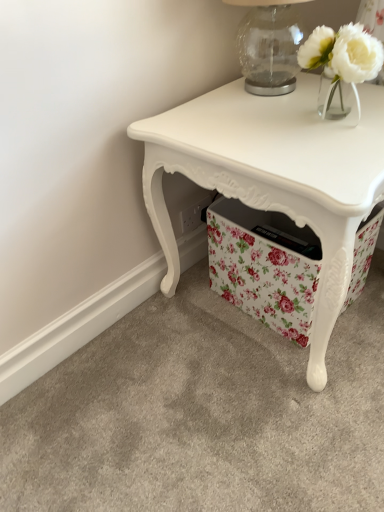
Describe the element at coordinates (269, 45) in the screenshot. I see `transparent glass table lamp at upper right` at that location.

Describe the element at coordinates (274, 176) in the screenshot. The height and width of the screenshot is (512, 384). I see `white glossy table at center` at that location.

The image size is (384, 512). What are the coordinates of `floral fabric storage box at lower center` in the screenshot? It's located at (264, 266).

Image resolution: width=384 pixels, height=512 pixels. What do you see at coordinates (264, 266) in the screenshot?
I see `floral fabric storage box at lower center` at bounding box center [264, 266].

Where is `white glass vase at upper right`? white glass vase at upper right is located at coordinates (341, 67).

Which is behind, point (275, 57) or point (316, 240)?

The point (316, 240) is behind.

Is transparent glass table lamp at upper right shorter than floral fabric storage box at lower center?

Indeed, transparent glass table lamp at upper right has a lesser height compared to floral fabric storage box at lower center.

Is transparent glass table lamp at upper right located outside floral fabric storage box at lower center?

Yes, transparent glass table lamp at upper right is not within floral fabric storage box at lower center.

From the picture: How different are the orientations of transparent glass table lamp at upper right and floral fabric storage box at lower center in degrees?

transparent glass table lamp at upper right and floral fabric storage box at lower center are facing 5.46 degrees away from each other.

From a real-world perspective, who is located higher, floral fabric storage box at lower center or white glossy table at center?

white glossy table at center, from a real-world perspective.

Which object is closer to the camera, floral fabric storage box at lower center or white glossy table at center?

white glossy table at center is closer to the camera.

Could white glossy table at center be considered to be inside floral fabric storage box at lower center?

Definitely not — white glossy table at center is not inside floral fabric storage box at lower center.

Can you confirm if floral fabric storage box at lower center is taller than white glossy table at center?

No.

Which is behind, point (307, 271) or point (319, 112)?

The point (307, 271) is farther from the camera.

Which object is wider, floral fabric storage box at lower center or white glass vase at upper right?

floral fabric storage box at lower center is wider.

Does floral fabric storage box at lower center lie in front of white glass vase at upper right?

That is False.

Is floral fabric storage box at lower center bigger or smaller than white glass vase at upper right?

In the image, floral fabric storage box at lower center appears to be larger than white glass vase at upper right.

Where is `table below the white glass vase at upper right (from a real-world perspective)`? The height and width of the screenshot is (512, 384). table below the white glass vase at upper right (from a real-world perspective) is located at coordinates (274, 176).

Is point (255, 124) positioned in front of point (324, 72)?

That is True.

From the picture: Is white glass vase at upper right located within white glossy table at center?

No, white glass vase at upper right is not a part of white glossy table at center.

Is floral fabric storage box at lower center inside white glossy table at center?

Yes, floral fabric storage box at lower center is a part of white glossy table at center.

Considering the sizes of objects white glossy table at center and floral fabric storage box at lower center in the image provided, who is smaller, white glossy table at center or floral fabric storage box at lower center?

floral fabric storage box at lower center is smaller.

Does point (377, 182) appear closer or farther from the camera than point (279, 332)?

Clearly, point (377, 182) is closer to the camera than point (279, 332).

Is floral fabric storage box at lower center turned away from transparent glass table lamp at upper right?

No, floral fabric storage box at lower center is not facing away from transparent glass table lamp at upper right.

Which point is more distant from viewer, (298, 317) or (251, 22)?

The point (251, 22) is farther.

Is floral fabric storage box at lower center further to the viewer compared to transparent glass table lamp at upper right?

Yes, it is behind transparent glass table lamp at upper right.

At what (x,y) coordinates should I click in order to perform the action: click on floral arrangement in front of the floral fabric storage box at lower center. Please return your answer as a coordinate pair (x, y). The height and width of the screenshot is (512, 384). Looking at the image, I should click on tap(341, 67).

Is floral fabric storage box at lower center a part of white glass vase at upper right?

No, white glass vase at upper right does not contain floral fabric storage box at lower center.

Does white glass vase at upper right lie behind floral fabric storage box at lower center?

No, it is not.

Identify the location of storage box to the right of transparent glass table lamp at upper right. (264, 266).

Identify the location of storage box below the white glossy table at center (from a real-world perspective). The width and height of the screenshot is (384, 512). (264, 266).

Estimate the real-world distances between objects in this image. Which object is closer to white glass vase at upper right, transparent glass table lamp at upper right or floral fabric storage box at lower center?

transparent glass table lamp at upper right is closer to white glass vase at upper right.

Based on the photo, which object lies nearer to the anchor point white glossy table at center, white glass vase at upper right or transparent glass table lamp at upper right?

Among the two, white glass vase at upper right is located nearer to white glossy table at center.

Considering their positions, is white glass vase at upper right positioned further to transparent glass table lamp at upper right than floral fabric storage box at lower center?

Among the two, floral fabric storage box at lower center is located further to transparent glass table lamp at upper right.

Estimate the real-world distances between objects in this image. Which object is closer to white glass vase at upper right, white glossy table at center or transparent glass table lamp at upper right?

Among the two, transparent glass table lamp at upper right is located nearer to white glass vase at upper right.

When comparing their distances from transparent glass table lamp at upper right, does floral fabric storage box at lower center or white glass vase at upper right seem further?

floral fabric storage box at lower center.

Based on their spatial positions, is white glass vase at upper right or transparent glass table lamp at upper right closer to floral fabric storage box at lower center?

white glass vase at upper right lies closer to floral fabric storage box at lower center than the other object.

Which object lies further to the anchor point white glass vase at upper right, transparent glass table lamp at upper right or white glossy table at center?

white glossy table at center.

Estimate the real-world distances between objects in this image. Which object is closer to white glossy table at center, transparent glass table lamp at upper right or floral fabric storage box at lower center?

floral fabric storage box at lower center.

This screenshot has width=384, height=512. I want to click on floral arrangement between transparent glass table lamp at upper right and white glossy table at center from top to bottom, so click(341, 67).

Locate an element on the screen. This screenshot has height=512, width=384. table between transparent glass table lamp at upper right and floral fabric storage box at lower center vertically is located at coordinates (274, 176).

Find the location of a particular element. Image resolution: width=384 pixels, height=512 pixels. table that lies between white glass vase at upper right and floral fabric storage box at lower center from top to bottom is located at coordinates (274, 176).

You are a GUI agent. You are given a task and a screenshot of the screen. Output one action in this format:
    pyautogui.click(x=<x>, y=<y>)
    Task: Click on the floral arrangement between transparent glass table lamp at upper right and floral fabric storage box at lower center from top to bottom
    Image resolution: width=384 pixels, height=512 pixels.
    Given the screenshot: What is the action you would take?
    pyautogui.click(x=341, y=67)